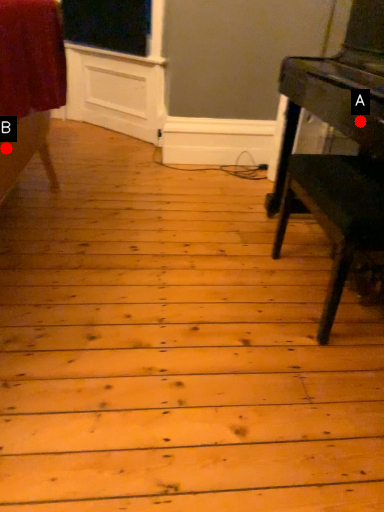
Question: Two points are circled on the image, labeled by A and B beside each circle. Which point is closer to the camera taking this photo?

Choices:
 (A) A is closer
 (B) B is closer

Answer: (B)